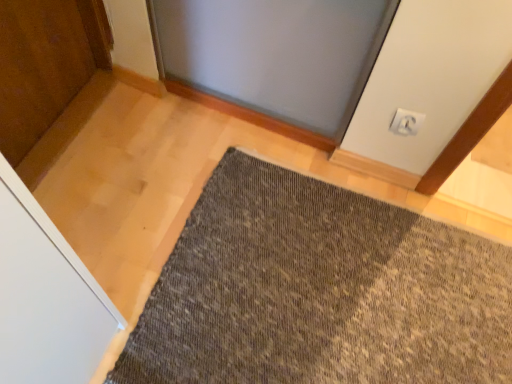
In order to click on free space above textured gray mat at center (from a real-world perspective) in this screenshot , I will do `click(292, 300)`.